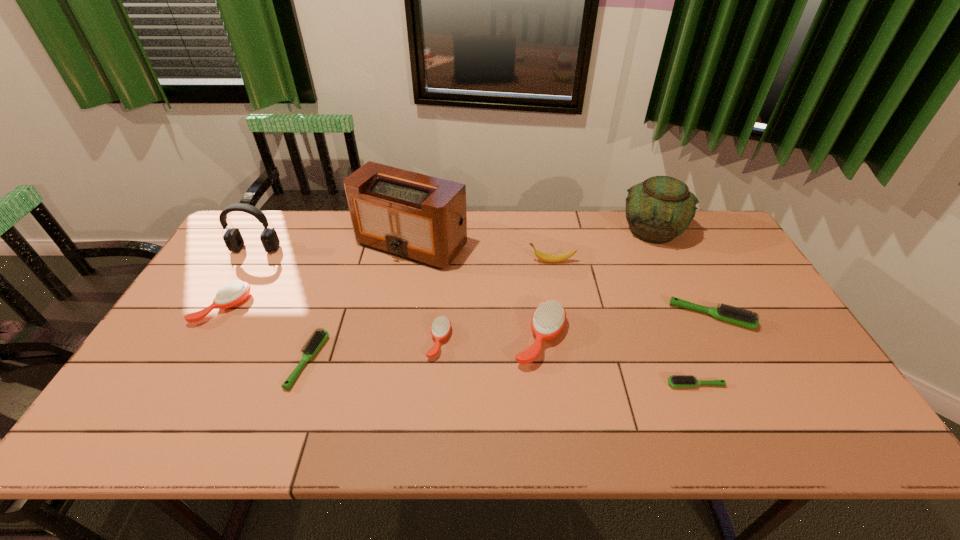
Find the location of `vacant space that satisfies the following two spatial constraints: 1. at the stem of the yellow banana; 2. on the front side of the fourth hairbrush from left to right`. vacant space that satisfies the following two spatial constraints: 1. at the stem of the yellow banana; 2. on the front side of the fourth hairbrush from left to right is located at coordinates pyautogui.click(x=565, y=339).

Locate an element on the screen. free space in the image that satisfies the following two spatial constraints: 1. on the headband of the headset; 2. on the left side of the biggest light hairbrush is located at coordinates click(216, 316).

This screenshot has height=540, width=960. Identify the location of free space that satisfies the following two spatial constraints: 1. on the headband of the headset; 2. on the left side of the leftmost hairbrush. (222, 307).

Image resolution: width=960 pixels, height=540 pixels. Find the location of `vacant point that satisfies the following two spatial constraints: 1. on the headband of the headset; 2. on the left side of the leftmost light hairbrush`. vacant point that satisfies the following two spatial constraints: 1. on the headband of the headset; 2. on the left side of the leftmost light hairbrush is located at coordinates (190, 361).